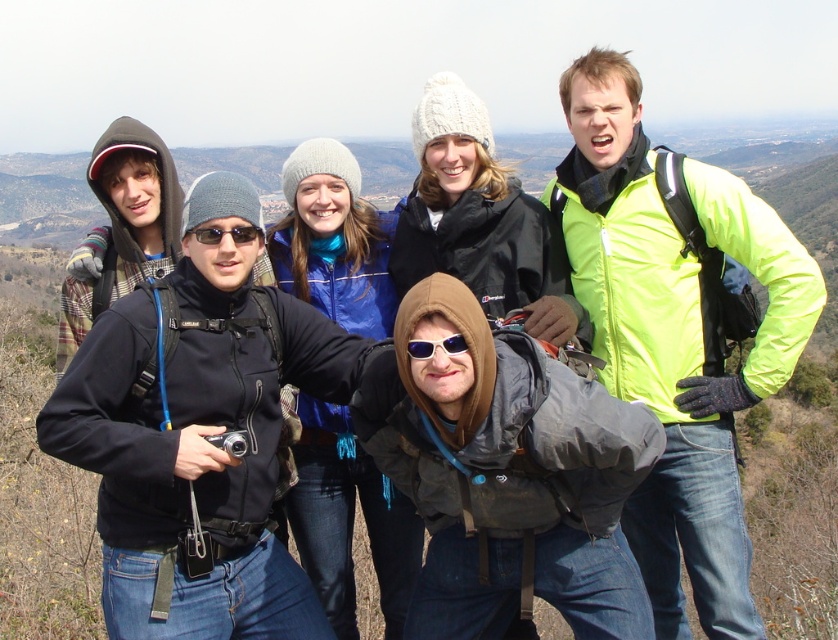
You are standing at the point with coordinates point (216, 234) and want to walk to point (790, 289). Which direction should you move in to get closer to your destination?

To move from point (216, 234) to point (790, 289), you should move towards the upper right direction since point (790, 289) is further to the viewer than point (216, 234).

Looking at this image, in the image of the hiking group, where exactly is the neon yellow jacket at upper right located in terms of coordinates?

The neon yellow jacket at upper right is located at point (675, 333).